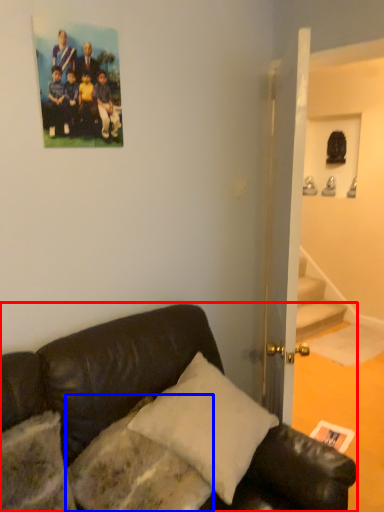
Question: Among these objects, which one is farthest to the camera, studio couch (highlighted by a red box) or pillow (highlighted by a blue box)?

Choices:
 (A) studio couch
 (B) pillow

Answer: (B)